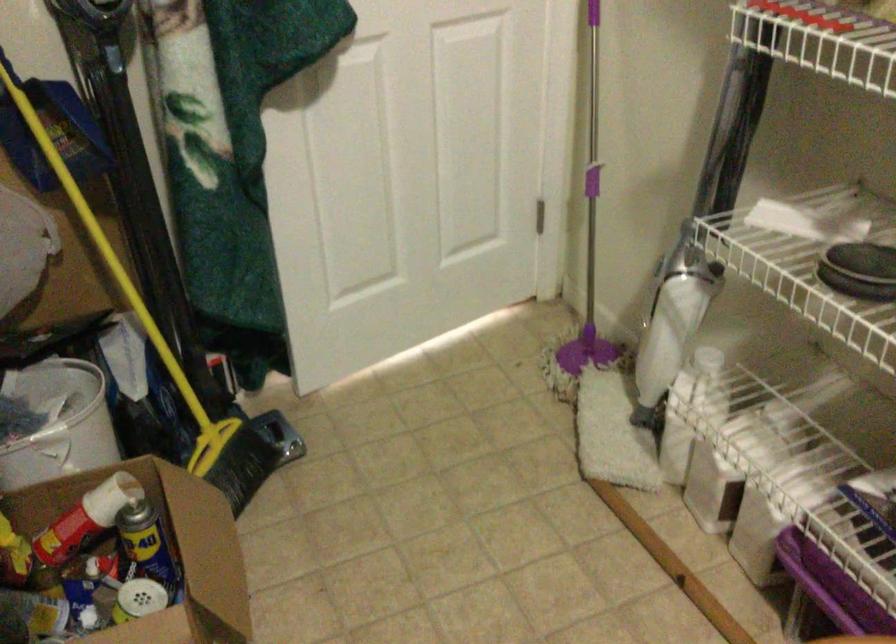
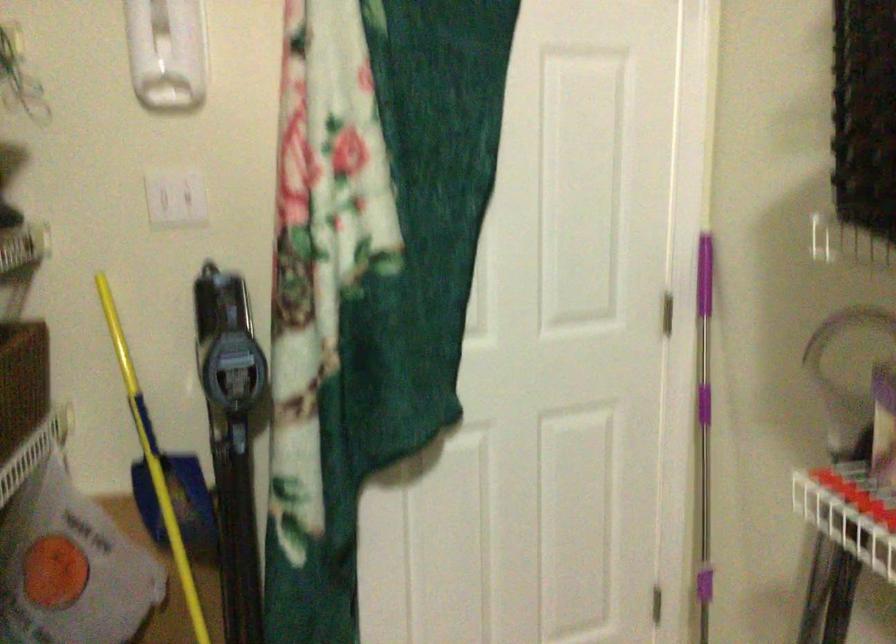
Question: The images are taken continuously from a first-person perspective. In which direction is your viewpoint rotating?

Choices:
 (A) Left
 (B) Right
 (C) Up
 (D) Down

Answer: (C)